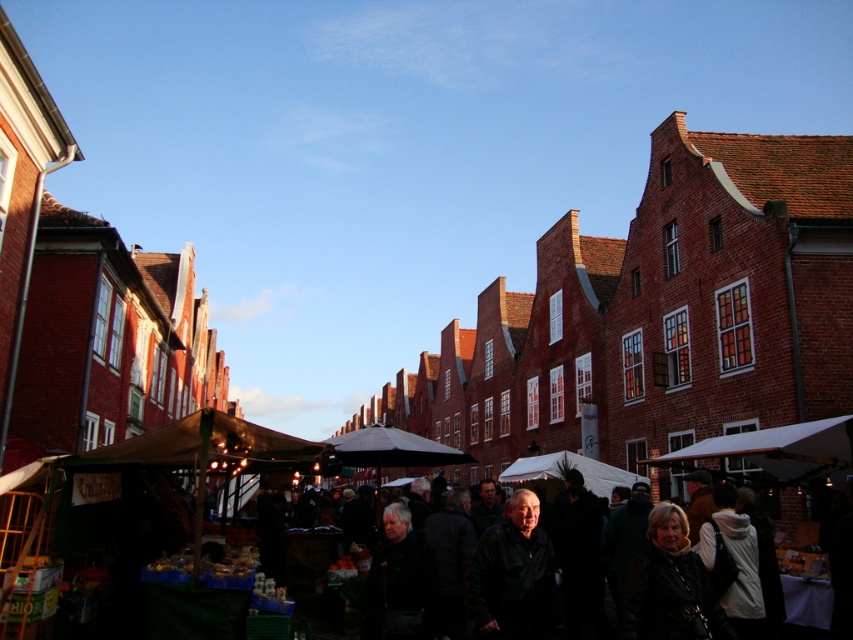
From the picture: Is black leather jacket at center above dark brown leather jacket at lower right?

Actually, black leather jacket at center is below dark brown leather jacket at lower right.

Who is more forward, (550, 611) or (660, 513)?

Point (660, 513) is in front.

Identify the location of black leather jacket at center. The image size is (853, 640). (514, 573).

Who is higher up, green fabric market stall at center or black leather jacket at center?

green fabric market stall at center is higher up.

Does point (212, 435) come farther from viewer compared to point (534, 573)?

Yes.

Find the location of a particular element. The width and height of the screenshot is (853, 640). green fabric market stall at center is located at coordinates coord(233,449).

Consider the image. Who is more forward, (164, 448) or (703, 636)?

Positioned in front is point (703, 636).

Can you confirm if green fabric market stall at center is taller than dark brown leather jacket at lower right?

Correct, green fabric market stall at center is much taller as dark brown leather jacket at lower right.

Does point (109, 449) come behind point (635, 620)?

Yes.

This screenshot has height=640, width=853. I want to click on green fabric market stall at center, so click(x=233, y=449).